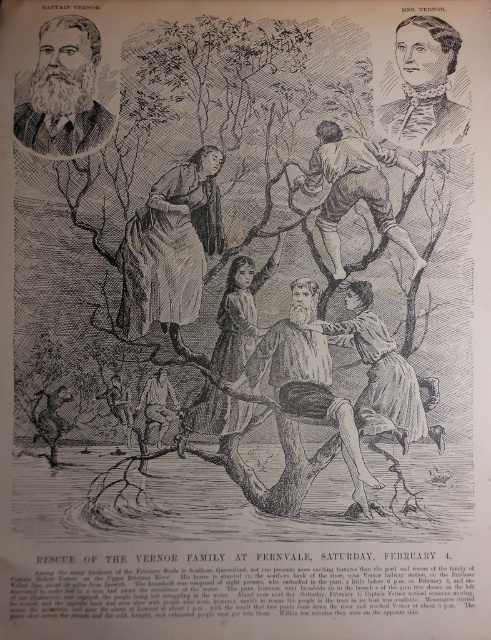
Question: Which is nearer to the smooth brown dress at center?

Choices:
 (A) brown textured dress at center
 (B) smooth brown skin at upper center
 (C) brown leather jacket at center
 (D) bearded man at upper left

Answer: (B)

Question: Is smooth brown dress at center above brown leather jacket at center?

Choices:
 (A) no
 (B) yes

Answer: (B)

Question: Considering the relative positions of brown textured dress at center and smooth brown skin at upper center in the image provided, where is brown textured dress at center located with respect to smooth brown skin at upper center?

Choices:
 (A) below
 (B) above

Answer: (A)

Question: Considering the real-world distances, which object is closest to the bearded man at upper left?

Choices:
 (A) brown leather jacket at center
 (B) smooth brown dress at center
 (C) brown textured dress at center

Answer: (C)

Question: Does smooth cream dress at upper right appear under brown leather jacket at center?

Choices:
 (A) no
 (B) yes

Answer: (A)

Question: Which is farther from the smooth brown skin at upper center?

Choices:
 (A) bearded man at upper left
 (B) smooth brown dress at center
 (C) brown leather jacket at center

Answer: (C)